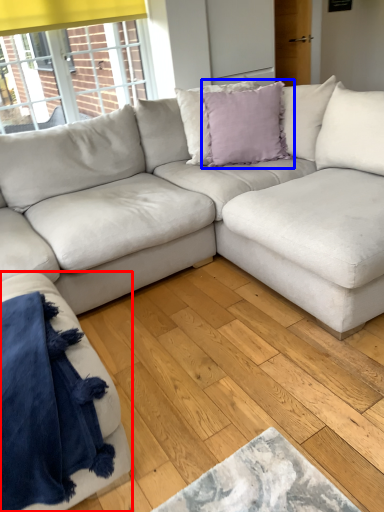
Question: Which point is further to the camera, studio couch (highlighted by a red box) or pillow (highlighted by a blue box)?

Choices:
 (A) studio couch
 (B) pillow

Answer: (B)